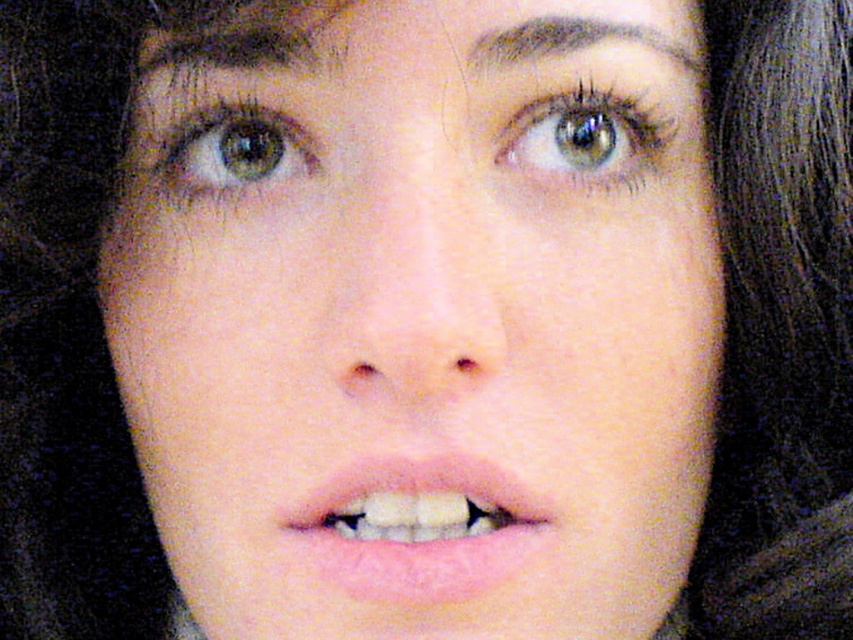
Is brown hair at upper center shorter than green matte eye at upper center?

Yes, brown hair at upper center is shorter than green matte eye at upper center.

Between point (693, 52) and point (582, 136), which one is positioned in front?

Point (582, 136) is more forward.

Where is `brown hair at upper center`? The width and height of the screenshot is (853, 640). brown hair at upper center is located at coordinates (245, 35).

Is pink matte lips at center wider than green matte eye at upper left?

Yes.

Is pink matte lips at center smaller than green matte eye at upper left?

No.

Between point (370, 573) and point (196, 166), which one is positioned behind?

Positioned behind is point (196, 166).

Find the location of a particular element. Image resolution: width=853 pixels, height=640 pixels. pink matte lips at center is located at coordinates (419, 528).

In the scene shown: Is brown hair at upper center to the right of green matte eye at upper left from the viewer's perspective?

Indeed, brown hair at upper center is positioned on the right side of green matte eye at upper left.

This screenshot has width=853, height=640. I want to click on brown hair at upper center, so click(245, 35).

Where is `brown hair at upper center`? The image size is (853, 640). brown hair at upper center is located at coordinates (245, 35).